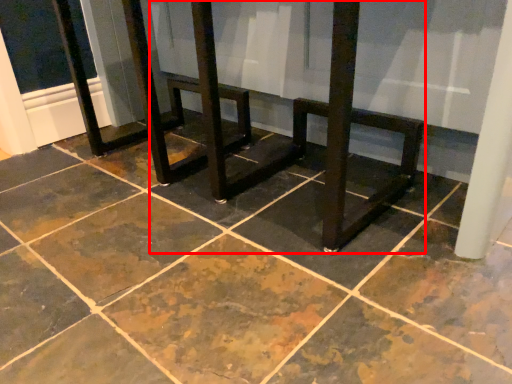
Question: Where is round table (annotated by the red box) located in relation to concrete in the image?

Choices:
 (A) right
 (B) left

Answer: (A)